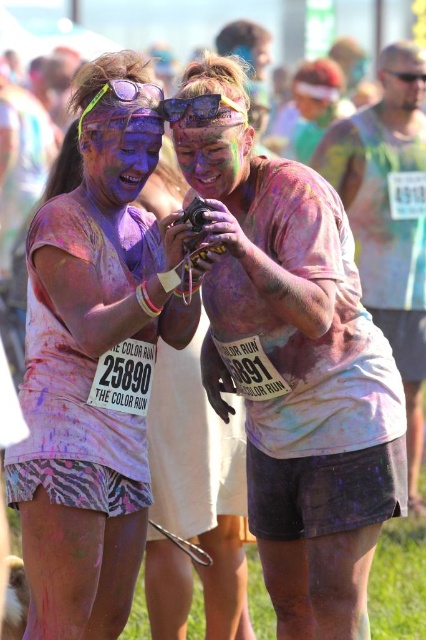
Question: Can you confirm if purple matte face at center is thinner than multicolored paint face at center?

Choices:
 (A) no
 (B) yes

Answer: (A)

Question: Is multicolored paint face at center positioned in front of sunglasses at center?

Choices:
 (A) no
 (B) yes

Answer: (A)

Question: Which object is farther from the camera taking this photo?

Choices:
 (A) matte pink shirt at center
 (B) matte black sunglasses at upper right
 (C) multicolored paint face at center

Answer: (B)

Question: Which object is positioned closest to the sunglasses at center?

Choices:
 (A) matte purple face paint at center
 (B) purple matte face at center

Answer: (B)

Question: Which point appears farthest from the camera in this image?

Choices:
 (A) 86,129
 (B) 299,200
 (C) 236,120

Answer: (A)

Question: Is matte purple face paint at center above multicolored paint face at center?

Choices:
 (A) no
 (B) yes

Answer: (A)